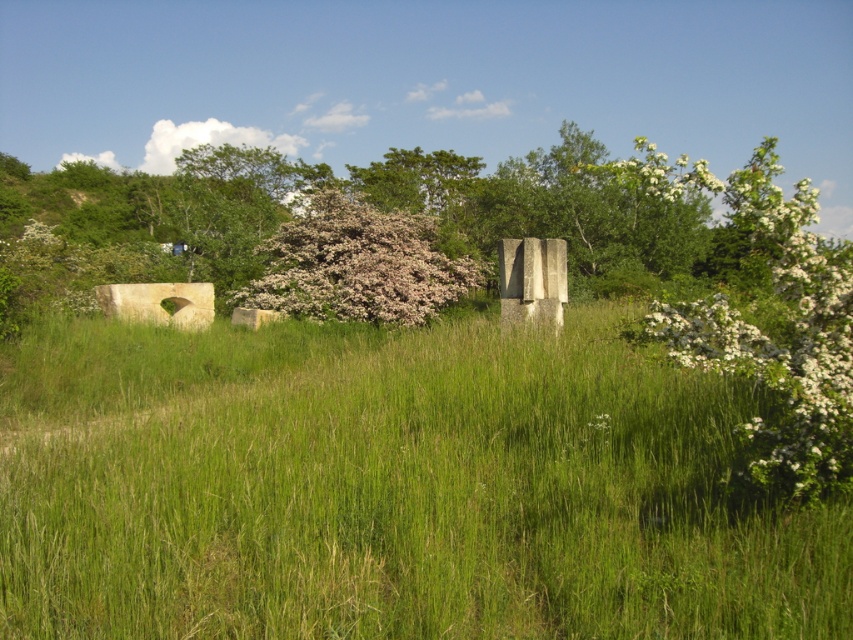
Question: Is green grass at center to the right of fluffy white blossoms at center from the viewer's perspective?

Choices:
 (A) no
 (B) yes

Answer: (B)

Question: Does green grass at center have a greater width compared to fluffy white blossoms at center?

Choices:
 (A) no
 (B) yes

Answer: (B)

Question: Does green grass at center have a smaller size compared to fluffy white blossoms at center?

Choices:
 (A) yes
 (B) no

Answer: (A)

Question: Which object appears farthest from the camera in this image?

Choices:
 (A) green grass at center
 (B) fluffy white blossoms at center

Answer: (B)